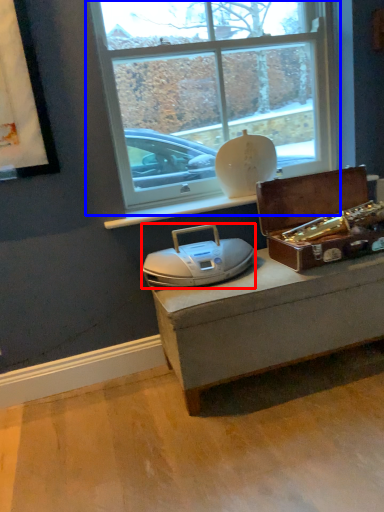
Question: Which point is further to the camera, stereo (highlighted by a red box) or window (highlighted by a blue box)?

Choices:
 (A) stereo
 (B) window

Answer: (B)